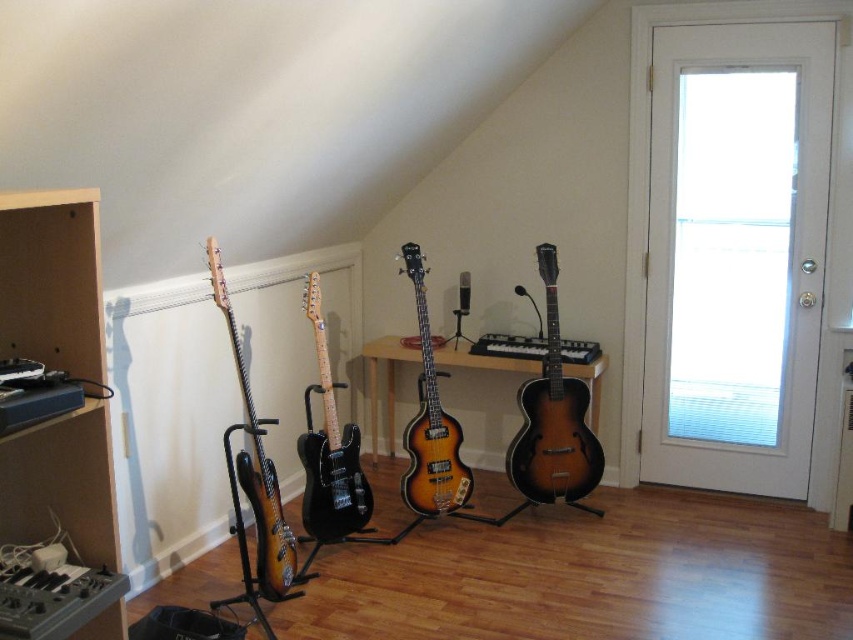
Question: Does black matte electric guitar at center appear under sunburst wood electric guitar at left?

Choices:
 (A) no
 (B) yes

Answer: (A)

Question: From the image, what is the correct spatial relationship of sunburst wood acoustic guitar at center in relation to black matte electric guitar at center?

Choices:
 (A) below
 (B) above

Answer: (B)

Question: Which is farther from the sunburst wood bass guitar at center?

Choices:
 (A) black matte electric guitar at center
 (B) sunburst wood electric guitar at left
 (C) sunburst wood acoustic guitar at center

Answer: (B)

Question: Which of the following is the farthest from the observer?

Choices:
 (A) (339, 529)
 (B) (561, 445)
 (C) (218, 289)

Answer: (B)

Question: Does black matte electric guitar at center have a lesser width compared to sunburst wood electric guitar at left?

Choices:
 (A) yes
 (B) no

Answer: (A)

Question: Which of the following is the closest to the observer?

Choices:
 (A) (430, 502)
 (B) (311, 305)
 (C) (552, 300)
 (D) (258, 429)

Answer: (D)